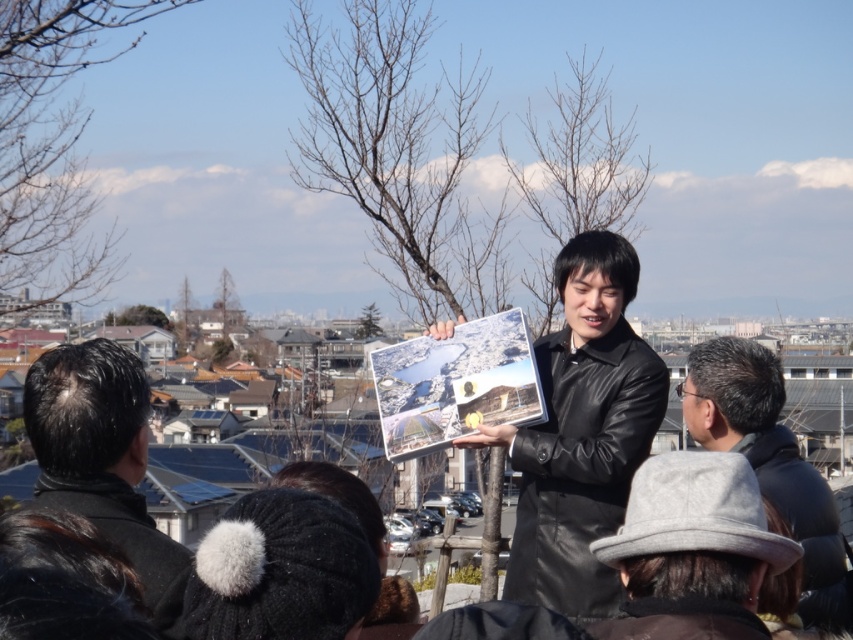
Question: Observing the image, what is the correct spatial positioning of black matte hair at lower left in reference to gray woolen hat at lower right?

Choices:
 (A) right
 (B) left

Answer: (B)

Question: Is black matte hair at lower left to the right of gray woolen hat at lower right from the viewer's perspective?

Choices:
 (A) yes
 (B) no

Answer: (B)

Question: Which point is farther to the camera?

Choices:
 (A) (712, 365)
 (B) (126, 404)
 (C) (657, 362)

Answer: (A)

Question: Which object is positioned closest to the black matte hair at lower left?

Choices:
 (A) gray woolen hat at lower right
 (B) black leather jacket at center

Answer: (B)

Question: Which object is closer to the camera taking this photo?

Choices:
 (A) black leather jacket at center
 (B) black matte hair at lower left

Answer: (B)

Question: Can you confirm if black leather jacket at center is bigger than gray woolen hat at lower right?

Choices:
 (A) yes
 (B) no

Answer: (A)